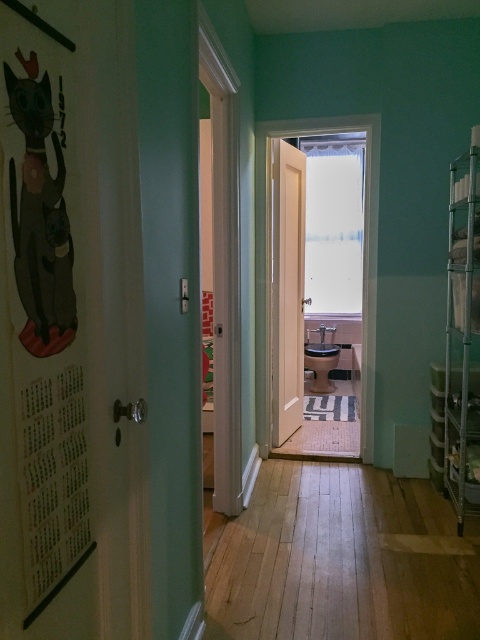
Question: Among these objects, which one is nearest to the camera?

Choices:
 (A) light brown wood flooring at center
 (B) matte black cat at left

Answer: (B)

Question: Can you confirm if light brown wood flooring at center is smaller than matte black cat at left?

Choices:
 (A) no
 (B) yes

Answer: (A)

Question: Observing the image, what is the correct spatial positioning of light brown wood flooring at center in reference to matte black cat at left?

Choices:
 (A) left
 (B) right

Answer: (B)

Question: Which object appears farthest from the camera in this image?

Choices:
 (A) light brown wood flooring at center
 (B) matte black cat at left

Answer: (A)

Question: Which point appears closest to the camera in this image?

Choices:
 (A) (43, 209)
 (B) (276, 513)

Answer: (A)

Question: Is light brown wood flooring at center above matte black cat at left?

Choices:
 (A) yes
 (B) no

Answer: (B)